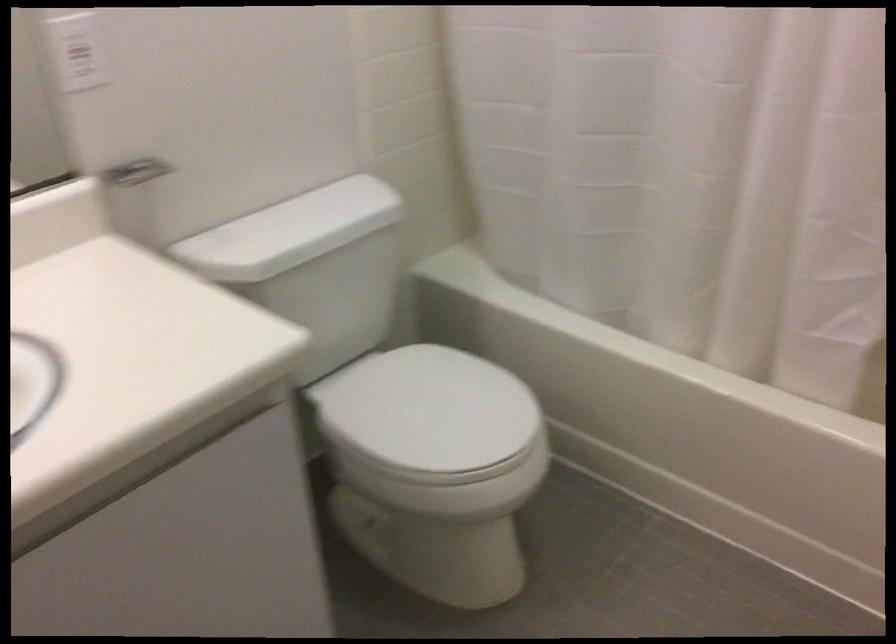
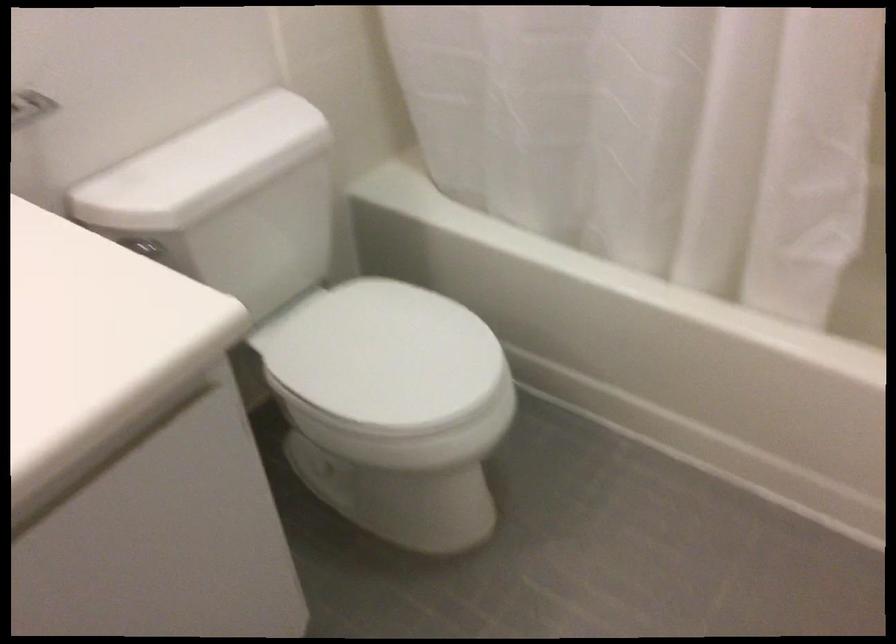
Question: In a continuous first-person perspective shot, in which direction is the camera moving?

Choices:
 (A) Left
 (B) Right
 (C) Forward
 (D) Backward

Answer: (C)